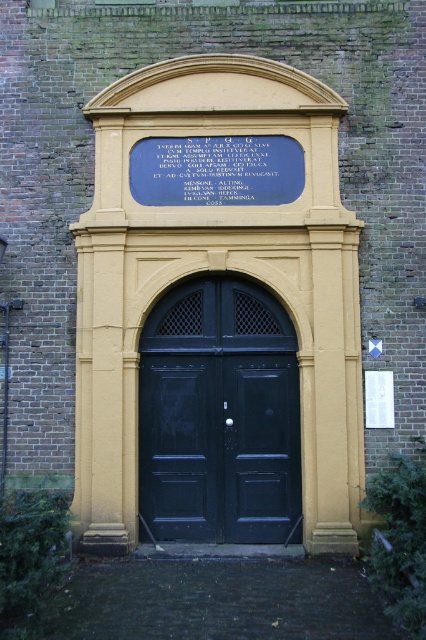
Question: Does black wooden door at center lie in front of blue stone plaque at upper center?

Choices:
 (A) no
 (B) yes

Answer: (B)

Question: Does black wooden door at center have a lesser width compared to blue stone plaque at upper center?

Choices:
 (A) no
 (B) yes

Answer: (B)

Question: Among these objects, which one is farthest from the camera?

Choices:
 (A) black wooden door at center
 (B) blue stone plaque at upper center

Answer: (B)

Question: Observing the image, what is the correct spatial positioning of black wooden door at center in reference to blue stone plaque at upper center?

Choices:
 (A) below
 (B) above

Answer: (A)

Question: Which of the following is the closest to the observer?

Choices:
 (A) (227, 476)
 (B) (167, 163)

Answer: (A)